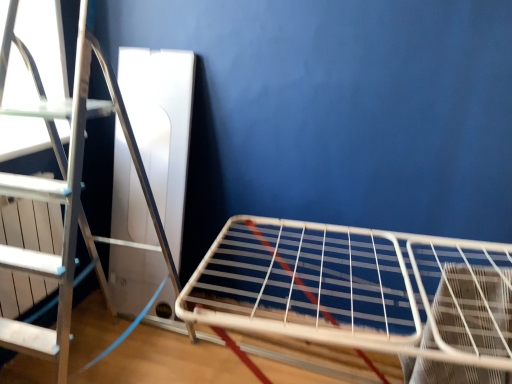
Question: From a real-world perspective, relative to silver metallic ladder at left, is white wire rack at lower right vertically above or below?

Choices:
 (A) below
 (B) above

Answer: (A)

Question: Considering the positions of point (314, 263) and point (5, 34), is point (314, 263) closer or farther from the camera than point (5, 34)?

Choices:
 (A) closer
 (B) farther

Answer: (B)

Question: In terms of height, does white wire rack at lower right look taller or shorter compared to silver metallic ladder at left?

Choices:
 (A) short
 (B) tall

Answer: (A)

Question: From a real-world perspective, is silver metallic ladder at left positioned above or below white wire rack at lower right?

Choices:
 (A) above
 (B) below

Answer: (A)

Question: From their relative heights in the image, would you say silver metallic ladder at left is taller or shorter than white wire rack at lower right?

Choices:
 (A) tall
 (B) short

Answer: (A)

Question: Is silver metallic ladder at left bigger or smaller than white wire rack at lower right?

Choices:
 (A) big
 (B) small

Answer: (A)

Question: From the image's perspective, is silver metallic ladder at left above or below white wire rack at lower right?

Choices:
 (A) below
 (B) above

Answer: (B)